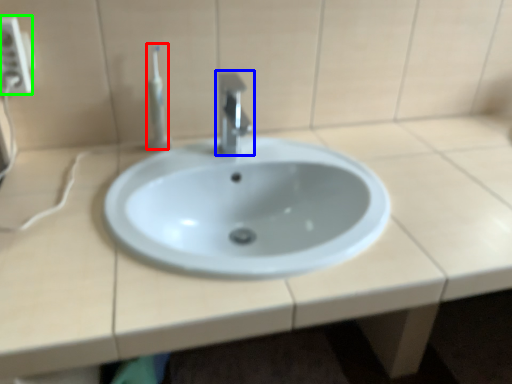
Question: Considering the real-world distances, which object is farthest from toothbrush (highlighted by a red box)? tap (highlighted by a blue box) or electric outlet (highlighted by a green box)?

Choices:
 (A) tap
 (B) electric outlet

Answer: (B)